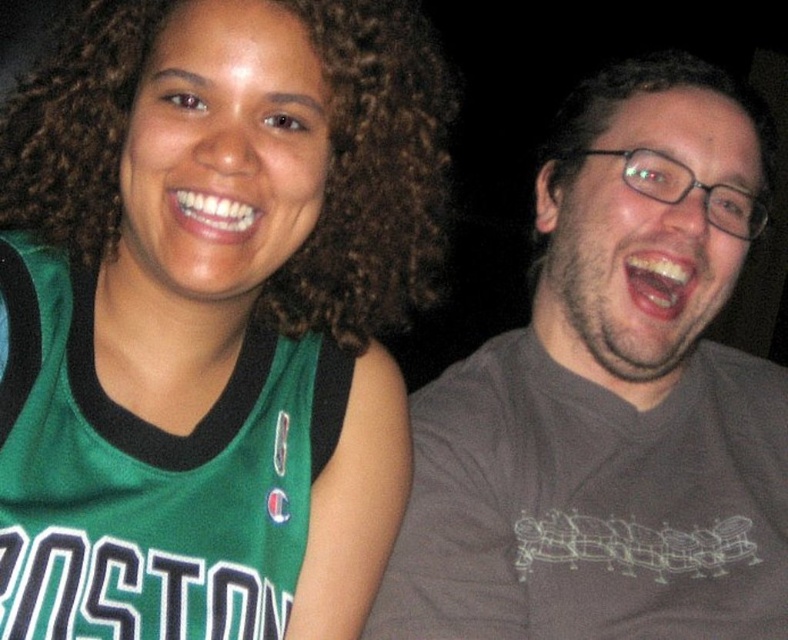
Can you confirm if green jersey at center is wider than gray cotton t-shirt at right?

No.

Is point (266, 344) less distant than point (694, 420)?

Yes.

The height and width of the screenshot is (640, 788). Describe the element at coordinates (210, 314) in the screenshot. I see `green jersey at center` at that location.

The width and height of the screenshot is (788, 640). I want to click on green jersey at center, so click(210, 314).